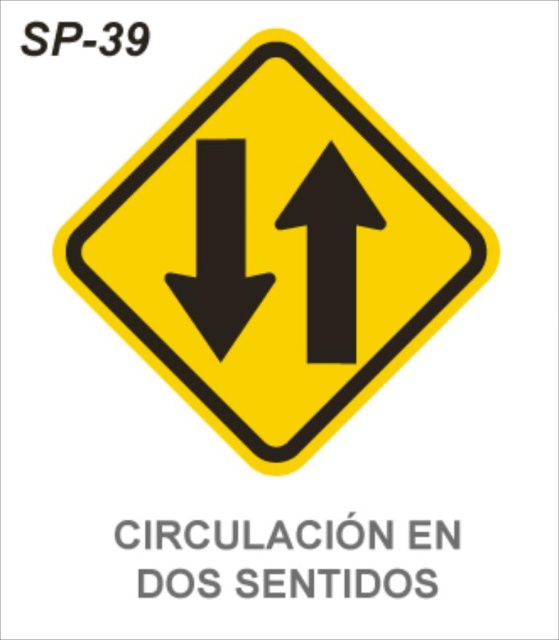
In the scene shown: Between black matte arrow at center and black solid arrow at center, which one appears on the left side from the viewer's perspective?

black matte arrow at center

Is black matte arrow at center positioned behind black solid arrow at center?

No, black matte arrow at center is in front of black solid arrow at center.

Where is `black matte arrow at center`? black matte arrow at center is located at coordinates (220, 250).

Identify the location of black matte arrow at center. (220, 250).

Which is behind, point (254, 134) or point (306, 232)?

Positioned behind is point (306, 232).

Which is above, yellow plastic diamond at center or black solid arrow at center?

yellow plastic diamond at center is above.

Which is behind, point (163, 250) or point (338, 152)?

The point (163, 250) is behind.

This screenshot has width=559, height=640. Find the location of `yellow plastic diamond at center`. yellow plastic diamond at center is located at coordinates (276, 252).

Which is behind, point (192, 250) or point (234, 227)?

The point (234, 227) is more distant.

Does yellow plastic diamond at center have a lesser width compared to black matte arrow at center?

In fact, yellow plastic diamond at center might be wider than black matte arrow at center.

You are a GUI agent. You are given a task and a screenshot of the screen. Output one action in this format:
    pyautogui.click(x=<x>, y=<y>)
    Task: Click on the yellow plastic diamond at center
    
    Given the screenshot: What is the action you would take?
    pyautogui.click(x=276, y=252)